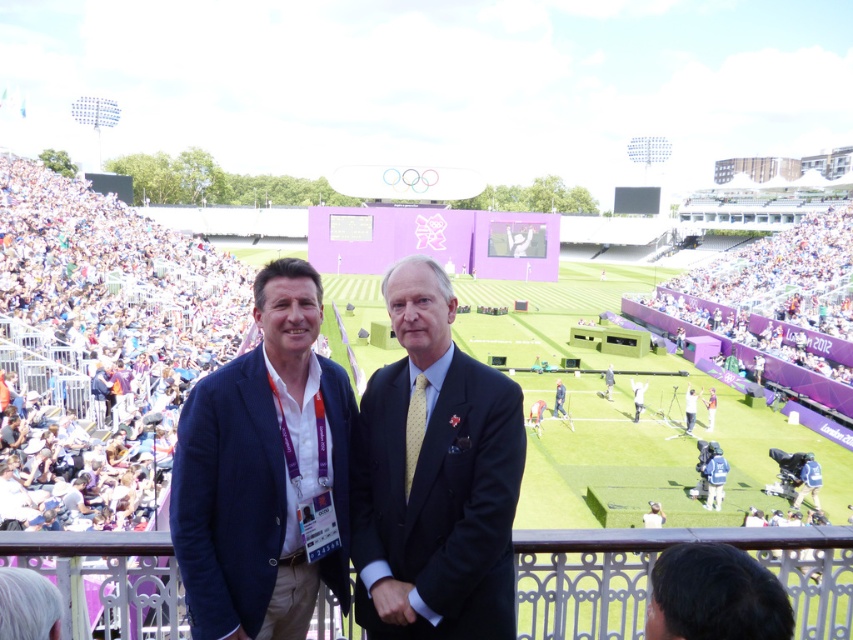
You are a photographer positioned at the edge of the stadium. You want to capture a photo that includes both the multicolored fabric crowd at left and the navy blue suit at center. Based on their positions, which object should you adjust your camera angle to include first?

Since the multicolored fabric crowd at left is to the left of the navy blue suit at center, you should first adjust your camera angle to include the multicolored fabric crowd at left as it is positioned further to the left side of the frame.

You are standing in the stadium and want to take a photo of the two points marked in the image. Which point, point (409, 384) or point (564, 417), will appear larger in your photo?

Point (409, 384) is closer to the camera than point (564, 417), so it will appear larger in the photo.